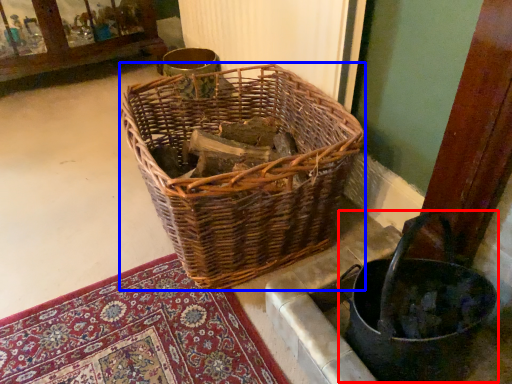
Question: Which of the following is the closest to the observer, basket container (highlighted by a red box) or picnic basket (highlighted by a blue box)?

Choices:
 (A) basket container
 (B) picnic basket

Answer: (A)